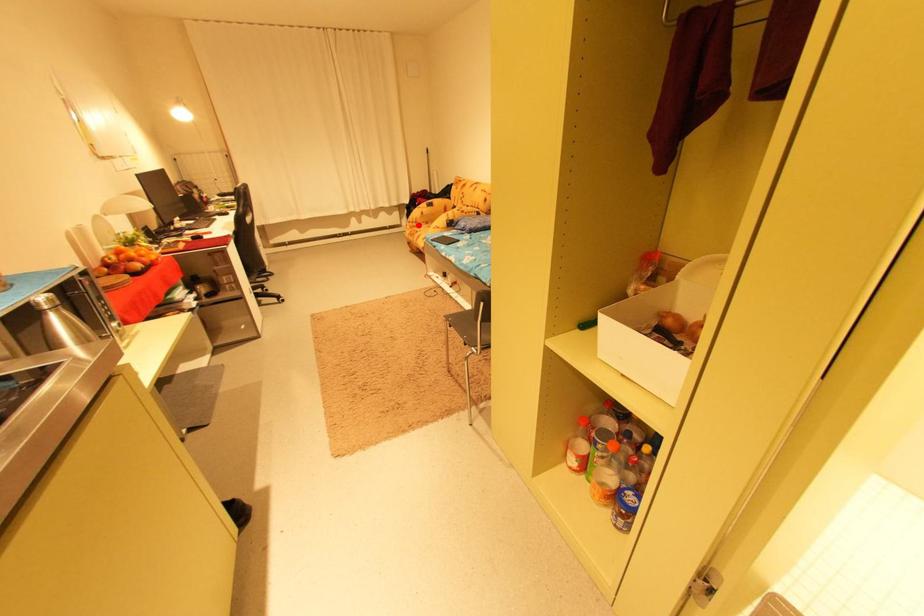
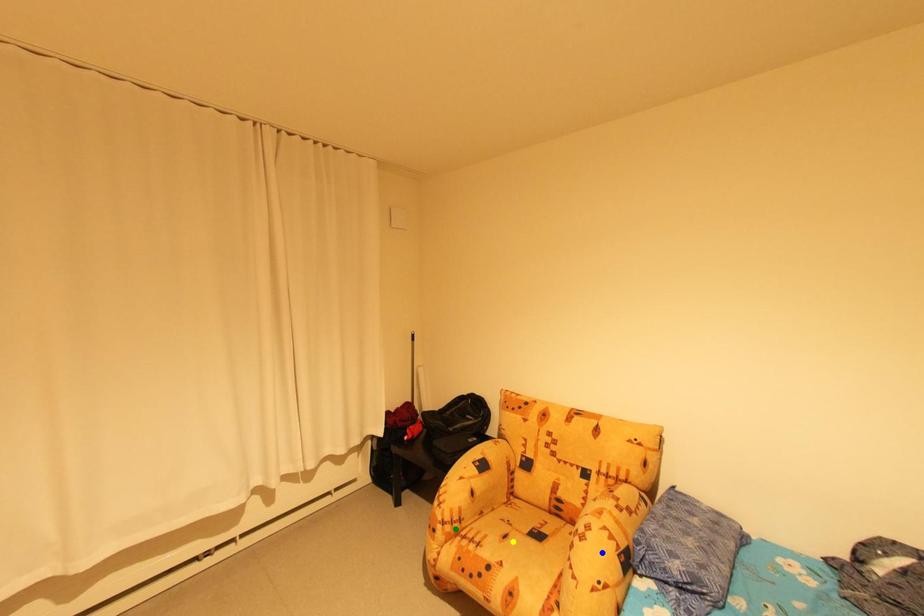
Question: I am providing you with two images of the same scene from different viewpoints. A red point is marked on the first image. You are given multiple points on the second image. Which spot in image 2 lines up with the point in image 1?

Choices:
 (A) green point
 (B) blue point
 (C) yellow point

Answer: (A)